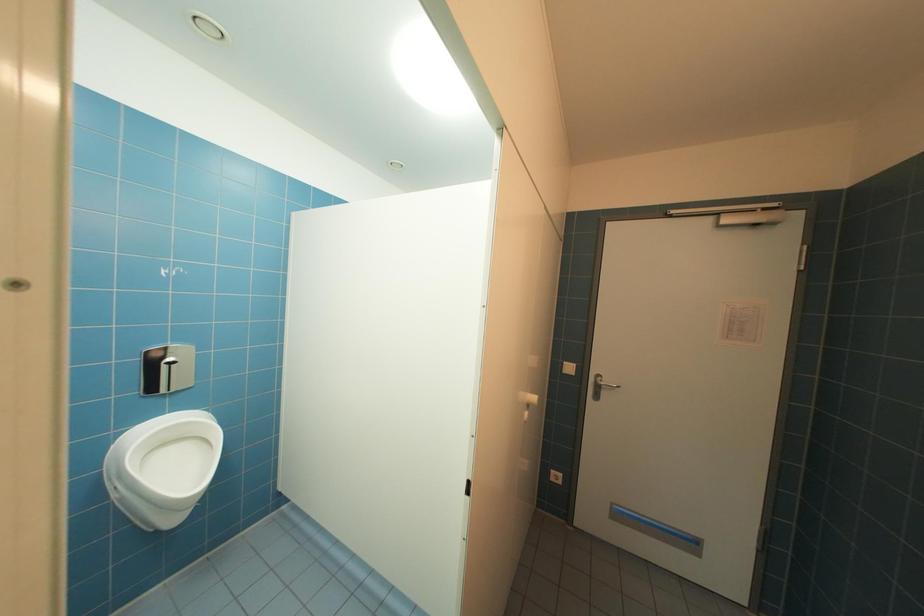
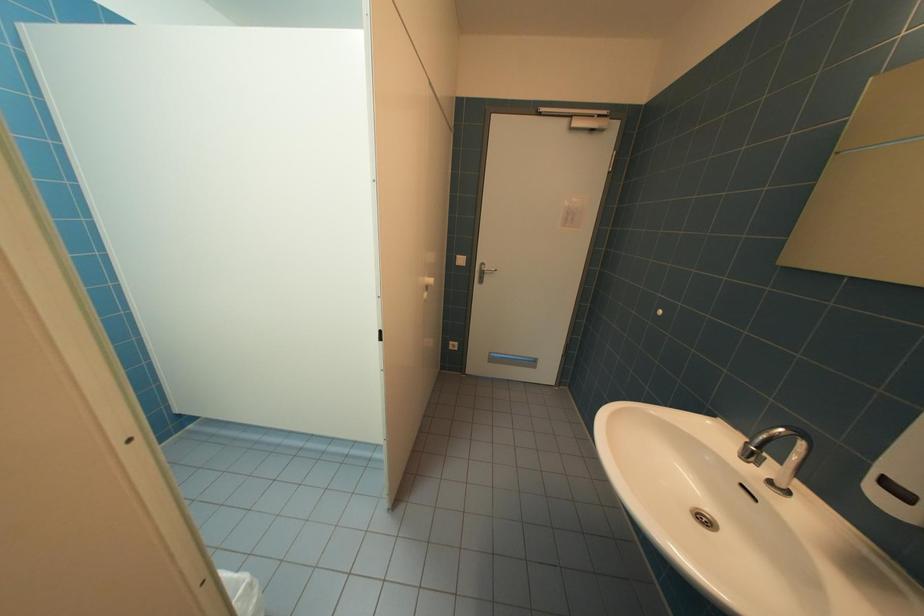
The first image is from the beginning of the video and the second image is from the end. How did the camera likely rotate when shooting the video?

The camera's rotation is toward right-down.